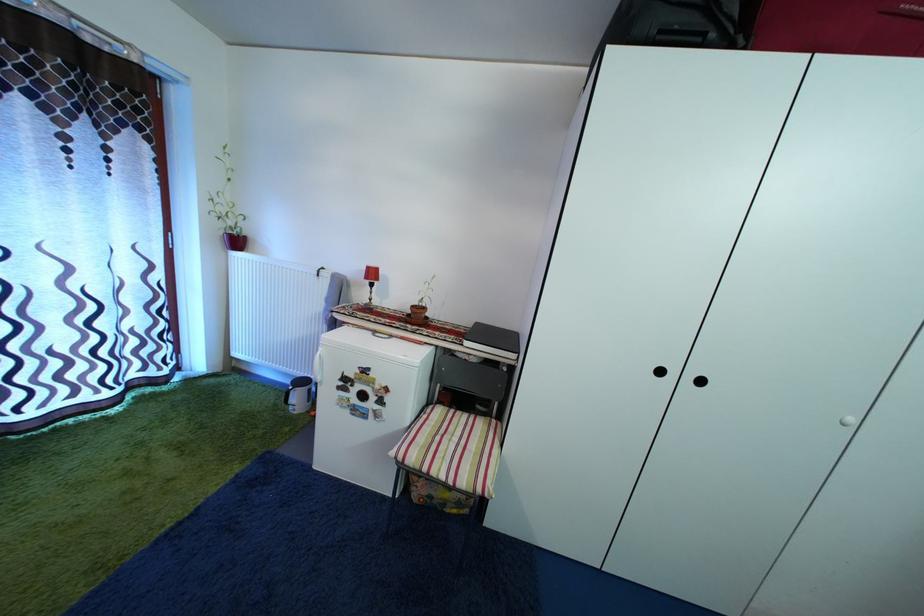
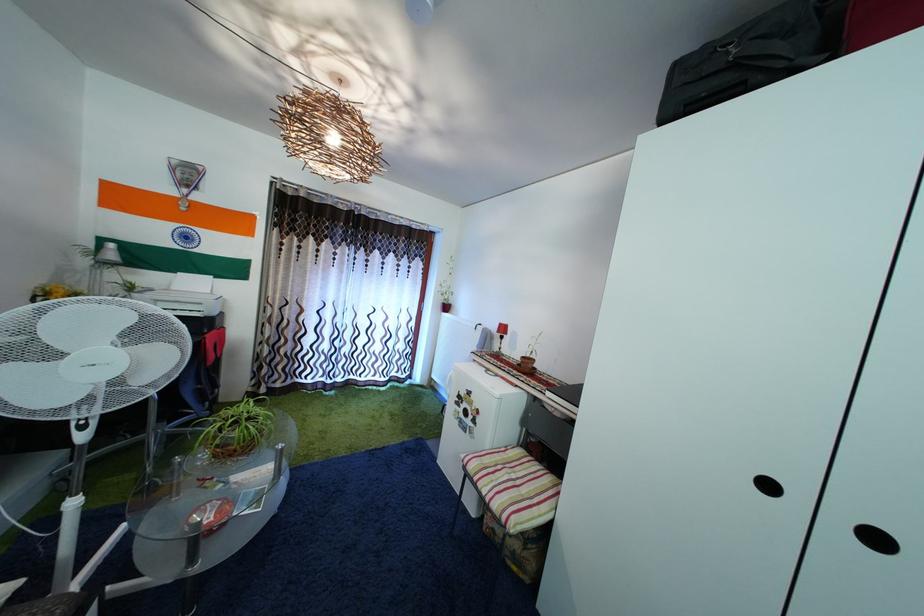
Question: The camera is either moving clockwise (left) or counter-clockwise (right) around the object. The first image is from the beginning of the video and the second image is from the end. Is the camera moving left or right when shooting the video?

Choices:
 (A) Left
 (B) Right

Answer: (B)